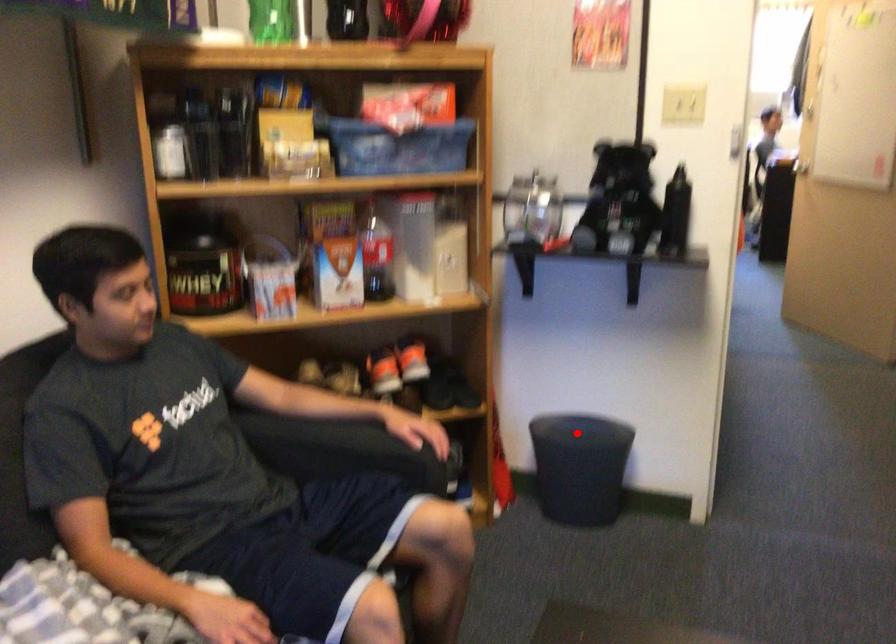
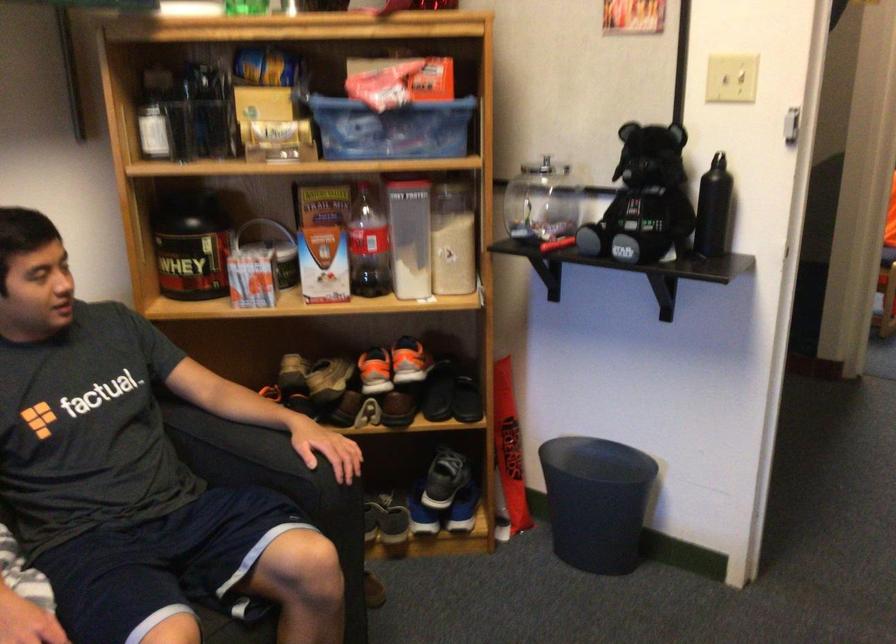
Find the pixel in the second image that matches the highlighted location in the first image.

(597, 460)